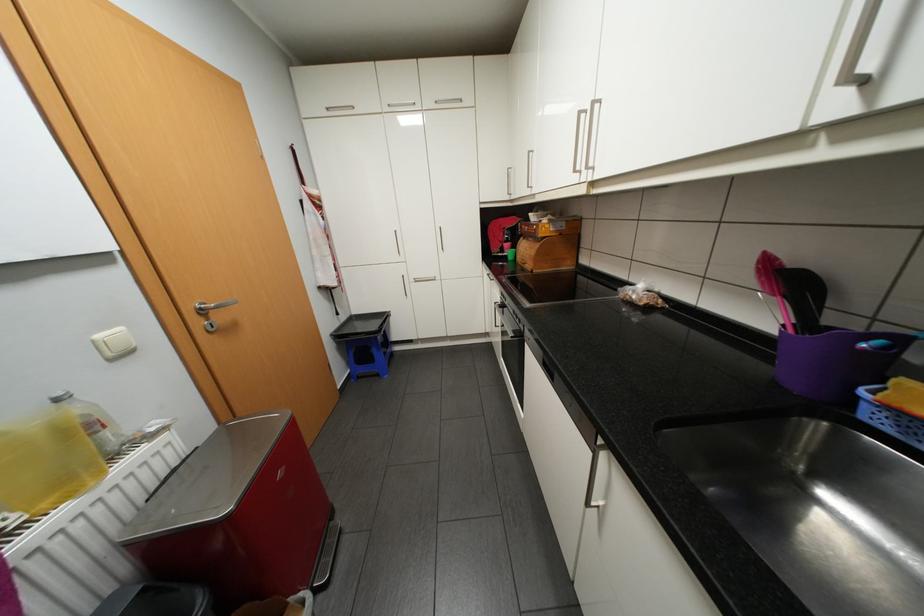
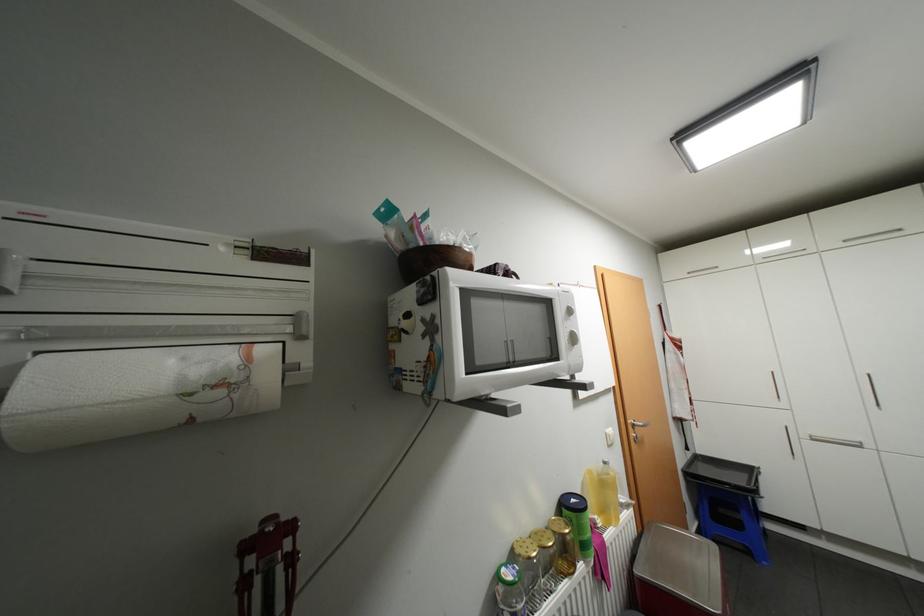
In the second image, find the point that corresponds to (423,280) in the first image.

(821, 438)